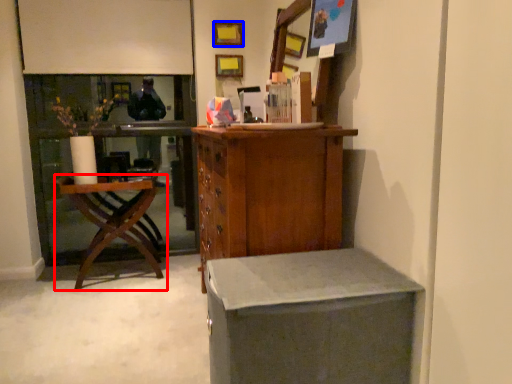
Question: Which point is further to the camera, chair (highlighted by a red box) or picture frame (highlighted by a blue box)?

Choices:
 (A) chair
 (B) picture frame

Answer: (B)